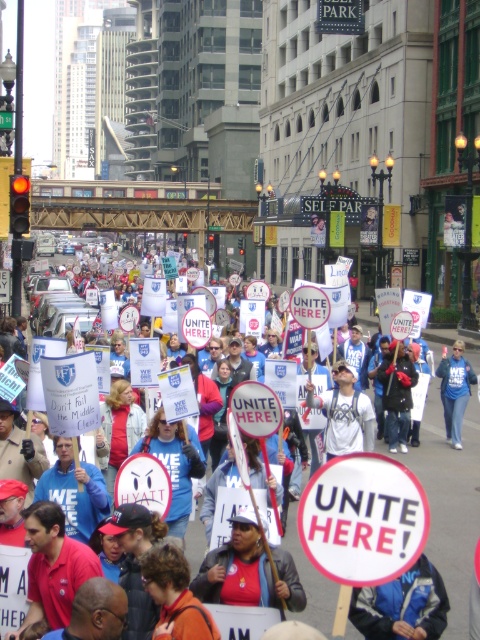
Question: Which object appears closest to the camera in this image?

Choices:
 (A) white paper sign at center
 (B) blue fabric sign at center

Answer: (A)

Question: Is the position of white paper sign at center less distant than that of blue fabric sign at center?

Choices:
 (A) no
 (B) yes

Answer: (B)

Question: Does white paper sign at center have a greater width compared to blue fabric sign at center?

Choices:
 (A) yes
 (B) no

Answer: (A)

Question: Which point appears farthest from the camera in this image?

Choices:
 (A) pyautogui.click(x=471, y=372)
 (B) pyautogui.click(x=476, y=420)

Answer: (B)

Question: Among these points, which one is nearest to the camera?

Choices:
 (A) (471, 554)
 (B) (457, 392)

Answer: (A)

Question: Is white paper sign at center closer to the viewer compared to blue fabric sign at center?

Choices:
 (A) no
 (B) yes

Answer: (B)